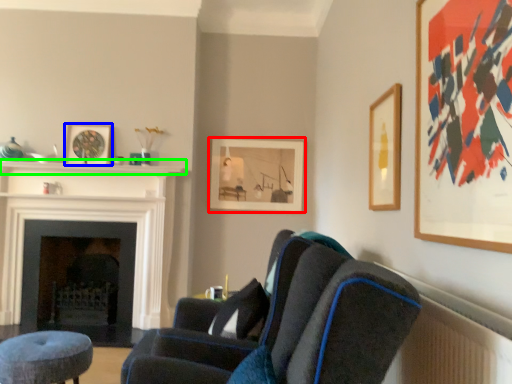
Question: Considering the real-world distances, which object is closest to picture frame (highlighted by a red box)? picture frame (highlighted by a blue box) or balustrade (highlighted by a green box).

Choices:
 (A) picture frame
 (B) balustrade

Answer: (B)